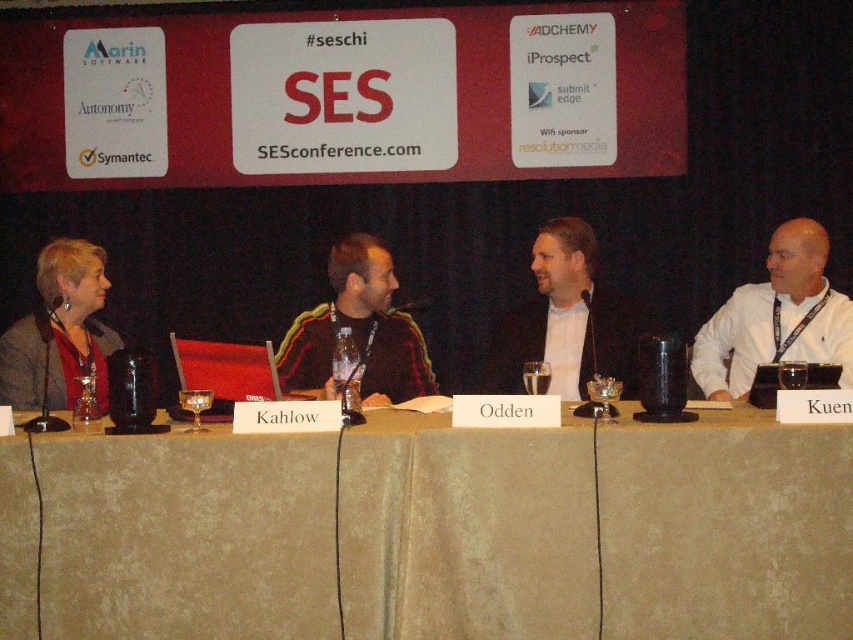
Locate an element on the screen. The height and width of the screenshot is (640, 853). white shirt at right is located at coordinates (776, 317).

Is matte black suit at center thinner than dark red fabric jacket at center?

No.

Does matte black suit at center have a smaller size compared to dark red fabric jacket at center?

Yes, matte black suit at center is smaller than dark red fabric jacket at center.

Locate an element on the screen. matte black suit at center is located at coordinates (567, 321).

Can you confirm if dark red fabric jacket at center is positioned below matte black jacket at left?

Actually, dark red fabric jacket at center is above matte black jacket at left.

Who is shorter, dark red fabric jacket at center or matte black jacket at left?

dark red fabric jacket at center is shorter.

Is point (347, 275) farther from viewer compared to point (51, 385)?

Yes.

Where is `dark red fabric jacket at center`? Image resolution: width=853 pixels, height=640 pixels. dark red fabric jacket at center is located at coordinates (357, 332).